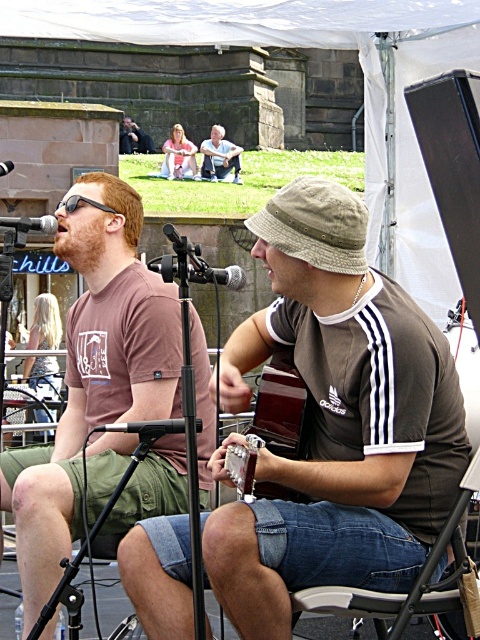
Question: Is brown glossy guitar at center to the left of smooth leather jacket at upper center from the viewer's perspective?

Choices:
 (A) no
 (B) yes

Answer: (A)

Question: Does light blue jeans at center have a lesser width compared to metallic silver microphone at left?

Choices:
 (A) no
 (B) yes

Answer: (B)

Question: Which of the following is the closest to the observer?

Choices:
 (A) brown cotton shirt at center
 (B) metallic silver microphone at left
 (C) black matte microphone at center

Answer: (C)

Question: Which point appears closest to the camera in this image?

Choices:
 (A) (132, 129)
 (B) (214, 275)

Answer: (B)

Question: Which of the following is the farthest from the observer?

Choices:
 (A) (251, 224)
 (B) (238, 275)
 (C) (471, 472)
 (D) (141, 413)

Answer: (D)

Question: Is denim fabric folding chair at lower center wider than brown glossy guitar at center?

Choices:
 (A) no
 (B) yes

Answer: (B)